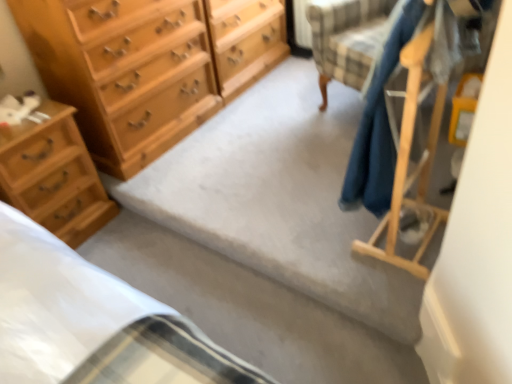
Question: Is carpet at center inside the boundaries of wooden coat rack at right, or outside?

Choices:
 (A) outside
 (B) inside

Answer: (A)

Question: Looking at the image, does carpet at center seem bigger or smaller compared to wooden coat rack at right?

Choices:
 (A) big
 (B) small

Answer: (B)

Question: Based on their relative distances, which object is nearer to the carpet at center?

Choices:
 (A) light brown wood chest of drawers at left, the 1th chest of drawers from the bottom
 (B) light wood chest of drawers at left, the first chest of drawers in the top-to-bottom sequence
 (C) wooden coat rack at right

Answer: (B)

Question: Which object is the closest to the carpet at center?

Choices:
 (A) light brown wood chest of drawers at left, the second chest of drawers in the top-to-bottom sequence
 (B) light wood chest of drawers at left, the first chest of drawers in the top-to-bottom sequence
 (C) wooden coat rack at right

Answer: (B)